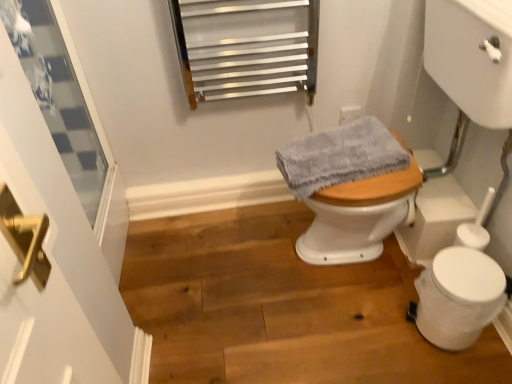
I want to click on vacant space in clear glass window at upper left (from a real-world perspective), so click(x=121, y=258).